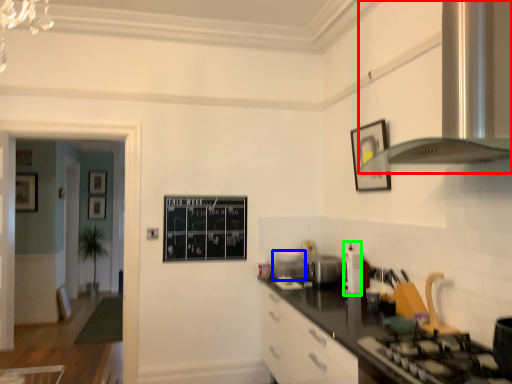
Question: Which object is the farthest from exhaust hood (highlighted by a red box)? Choose among these: appliance (highlighted by a blue box) or appliance (highlighted by a green box).

Choices:
 (A) appliance
 (B) appliance

Answer: (A)